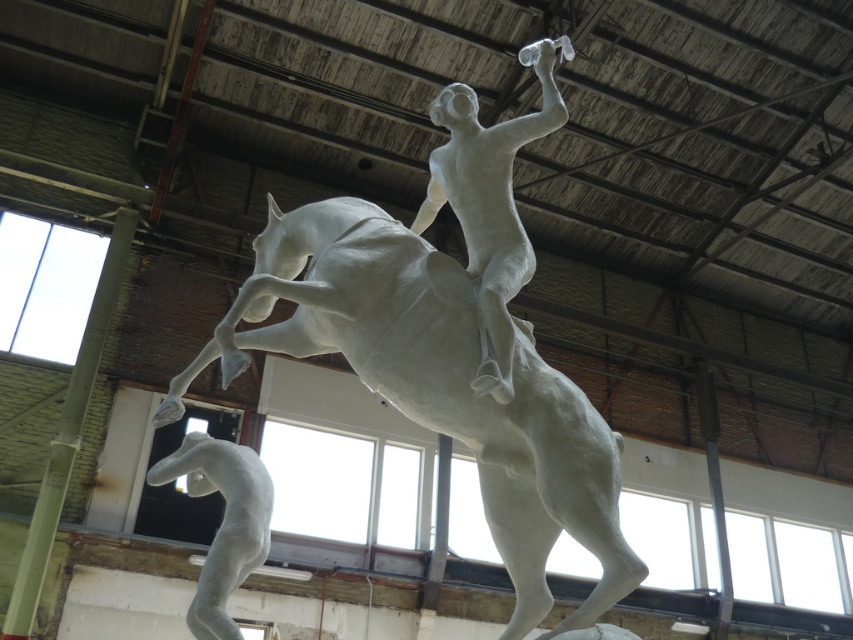
Is point (471, 140) positioned in front of point (184, 451)?

Yes.

Which is more to the left, white matte figure at center or white matte horse at lower left?

white matte horse at lower left is more to the left.

Who is more forward, (498, 282) or (260, 522)?

Point (498, 282) is more forward.

Find the location of `white matte figure at center`. white matte figure at center is located at coordinates (490, 204).

Can you confirm if white matte horse at center is positioned to the right of white matte figure at center?

Incorrect, white matte horse at center is not on the right side of white matte figure at center.

Based on the photo, who is more distant from viewer, (538, 456) or (492, 227)?

The point (492, 227) is behind.

Image resolution: width=853 pixels, height=640 pixels. I want to click on white matte horse at center, so click(450, 344).

Find the location of a particular element. The image size is (853, 640). white matte horse at center is located at coordinates (450, 344).

What do you see at coordinates (450, 344) in the screenshot?
I see `white matte horse at center` at bounding box center [450, 344].

Is white matte horse at center to the right of white matte horse at lower left from the viewer's perspective?

Indeed, white matte horse at center is positioned on the right side of white matte horse at lower left.

Between point (262, 339) and point (244, 541), which one is positioned behind?

The point (262, 339) is behind.

You are a GUI agent. You are given a task and a screenshot of the screen. Output one action in this format:
    pyautogui.click(x=<x>, y=<y>)
    Task: Click on the white matte horse at center
    The image size is (853, 640).
    Given the screenshot: What is the action you would take?
    pyautogui.click(x=450, y=344)